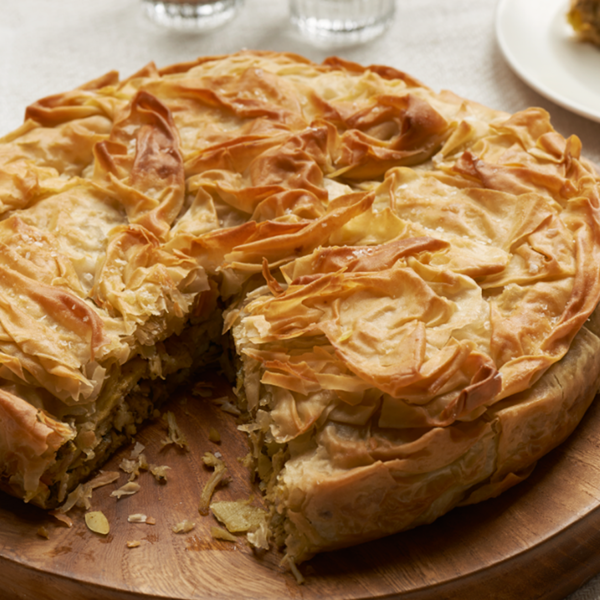
Locate an element on the screen. table is located at coordinates (433, 60).